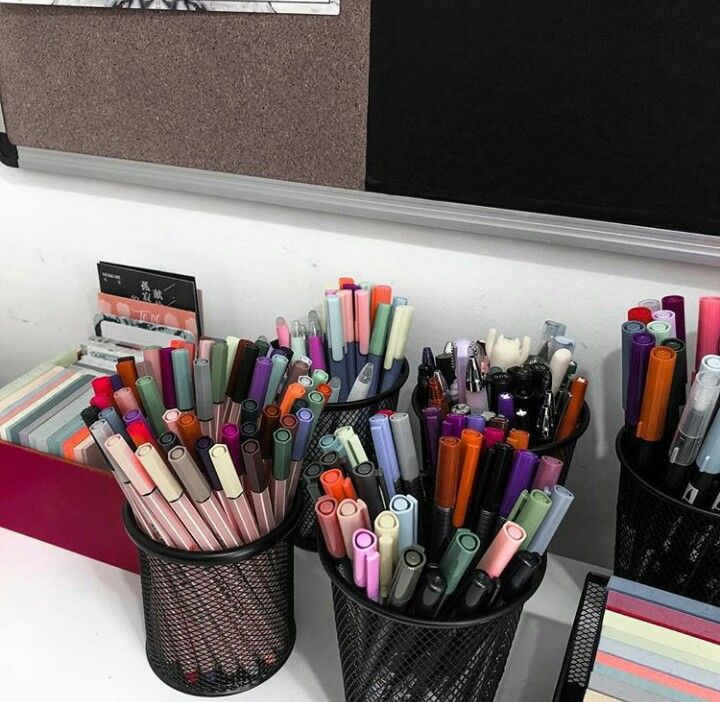
The width and height of the screenshot is (720, 702). In order to click on pen ornament in this screenshot , I will do `click(505, 352)`.